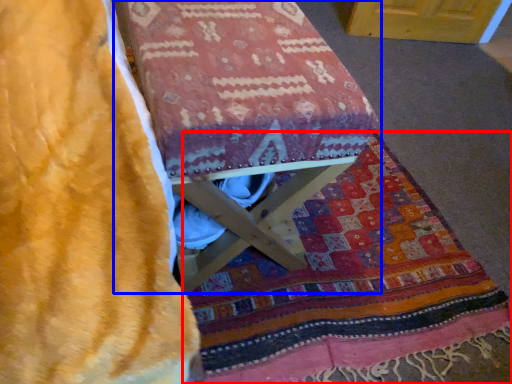
Question: Among these objects, which one is farthest to the camera, blanket (highlighted by a red box) or furniture (highlighted by a blue box)?

Choices:
 (A) blanket
 (B) furniture

Answer: (A)